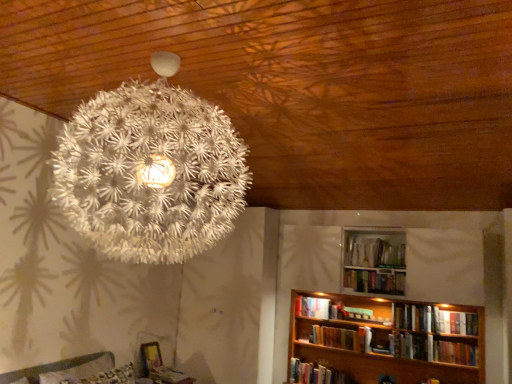
The width and height of the screenshot is (512, 384). Find the location of `free space above white textured lamp at upper center (from a real-world perspective)`. free space above white textured lamp at upper center (from a real-world perspective) is located at coordinates (167, 52).